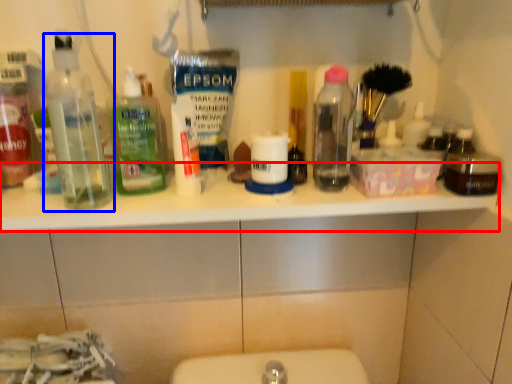
Question: Which object appears closest to the camera in this image, counter top (highlighted by a red box) or bottle (highlighted by a blue box)?

Choices:
 (A) counter top
 (B) bottle

Answer: (B)